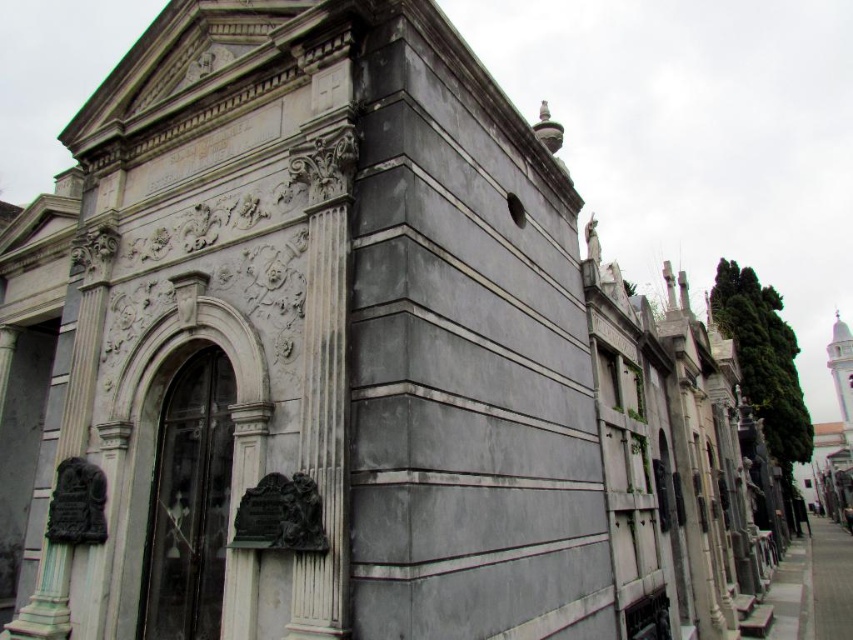
Is gray marble statue at center smaller than white marble column at center?

No.

Who is higher up, gray marble statue at center or white marble column at center?

gray marble statue at center

Describe the element at coordinates (466, 360) in the screenshot. I see `gray marble statue at center` at that location.

Image resolution: width=853 pixels, height=640 pixels. In order to click on gray marble statue at center in this screenshot , I will do `click(466, 360)`.